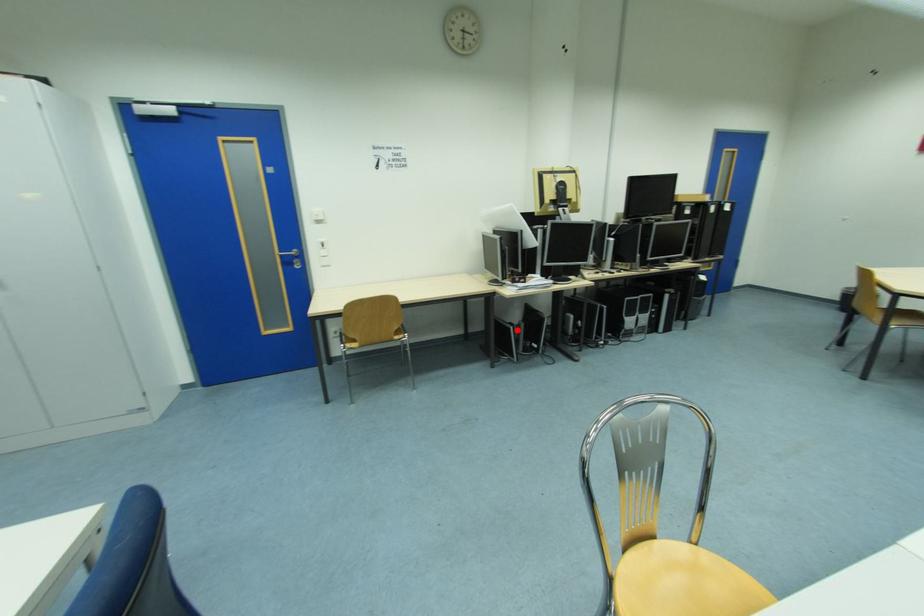
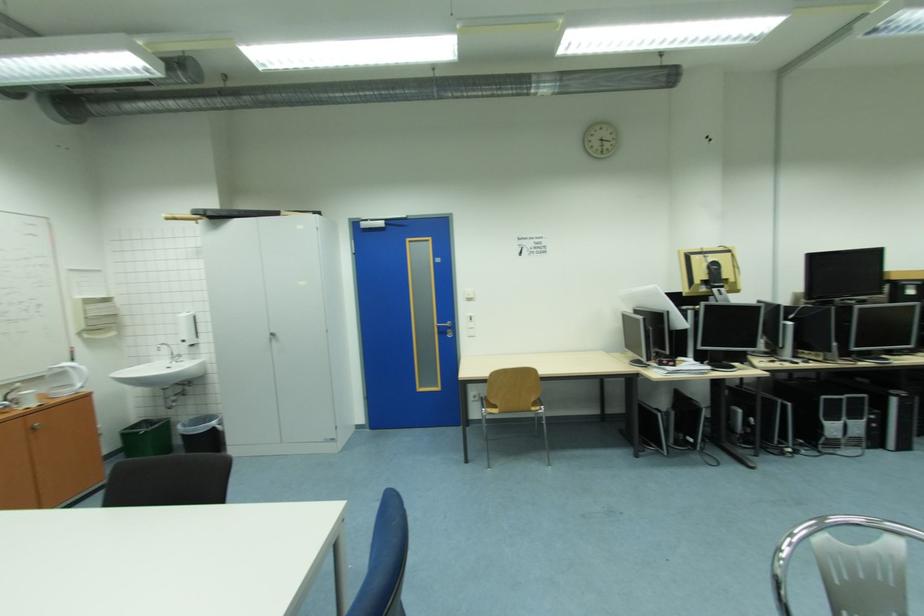
In the second image, find the point that corresponds to the highlighted location in the first image.

(663, 416)